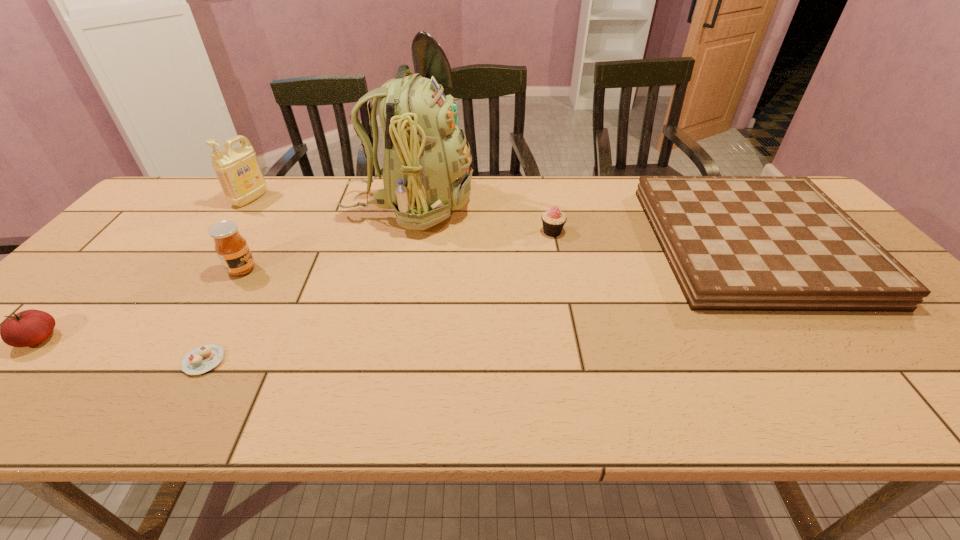
At what (x,y) coordinates should I click in order to perform the action: click on free space that satisfies the following two spatial constraints: 1. on the front-facing side of the right cupcake; 2. on the left side of the fifth object from left to right. Please return your answer as a coordinate pair (x, y). This screenshot has height=540, width=960. Looking at the image, I should click on (403, 232).

At what (x,y) coordinates should I click in order to perform the action: click on vacant region that satisfies the following two spatial constraints: 1. on the back side of the tomato; 2. on the right side of the sixth shortest object. Please return your answer as a coordinate pair (x, y). Looking at the image, I should click on (173, 199).

At what (x,y) coordinates should I click in order to perform the action: click on vacant space that satisfies the following two spatial constraints: 1. on the front-facing side of the rightmost object; 2. on the right side of the backpack. Please return your answer as a coordinate pair (x, y). The width and height of the screenshot is (960, 540). Looking at the image, I should click on tap(400, 244).

You are a GUI agent. You are given a task and a screenshot of the screen. Output one action in this format:
    pyautogui.click(x=<x>, y=<y>)
    Task: Click on the free space in the image that satisfies the following two spatial constraints: 1. on the front-facing side of the shorter cupcake; 2. on the right side of the honey
    The image size is (960, 540).
    Given the screenshot: What is the action you would take?
    pyautogui.click(x=187, y=361)